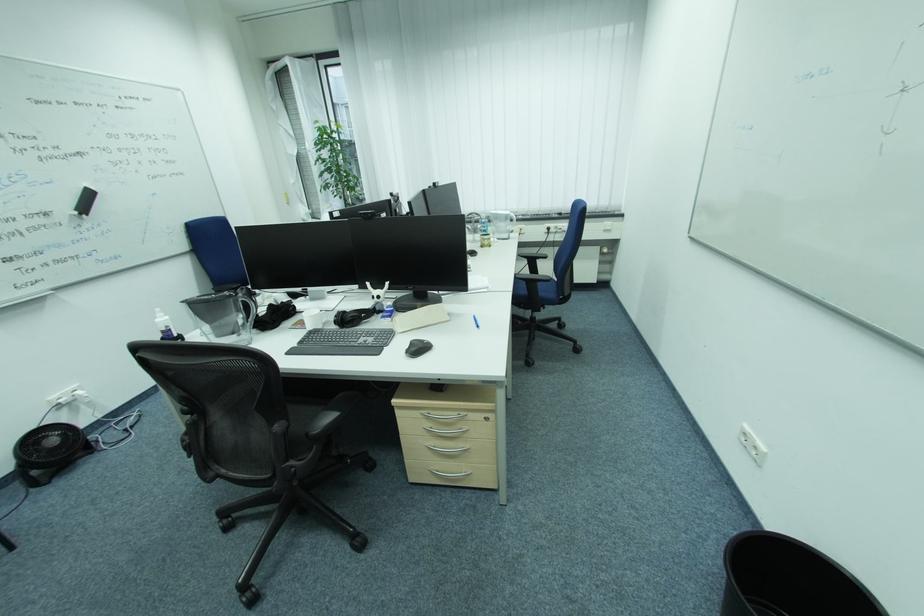
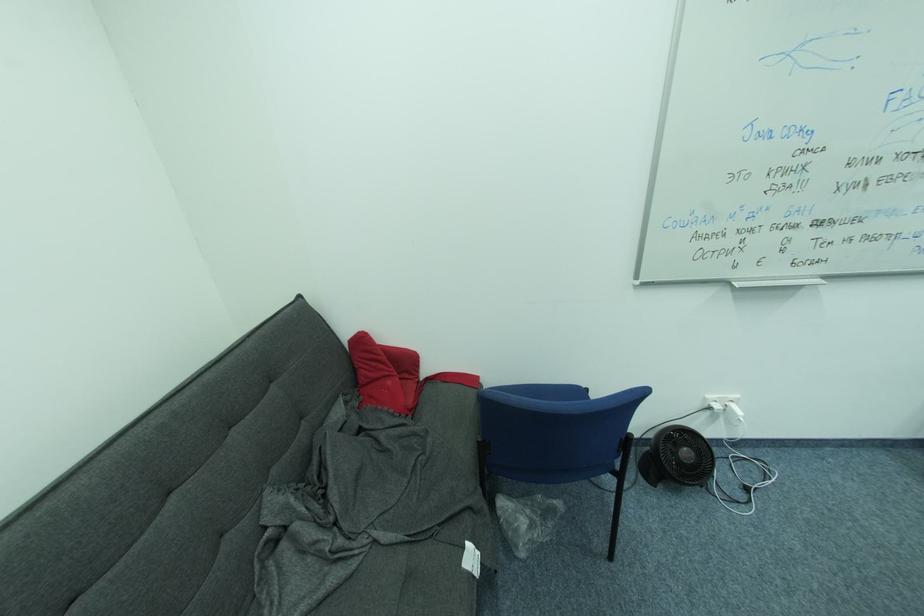
In the second image, find the point that corresponds to [40,490] in the first image.

(648, 479)